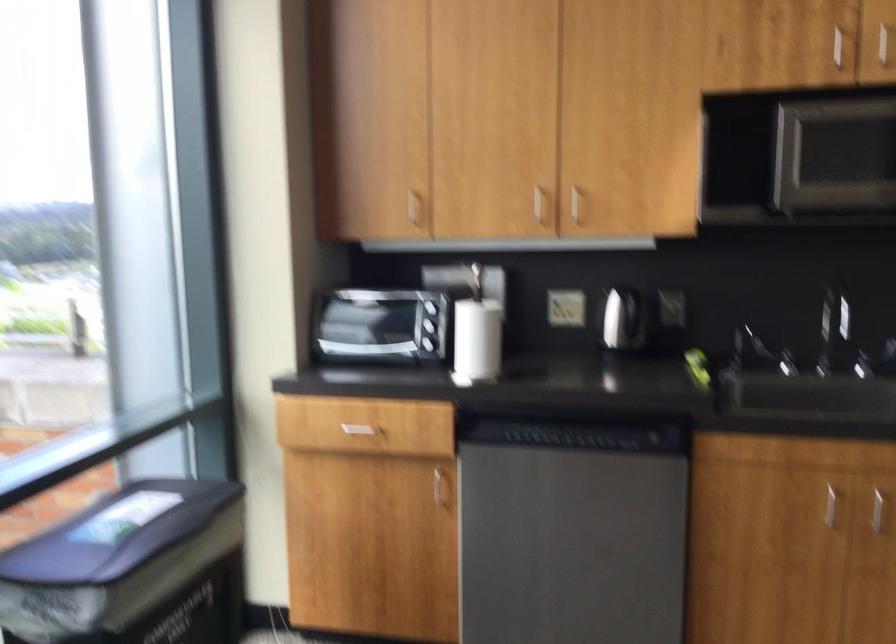
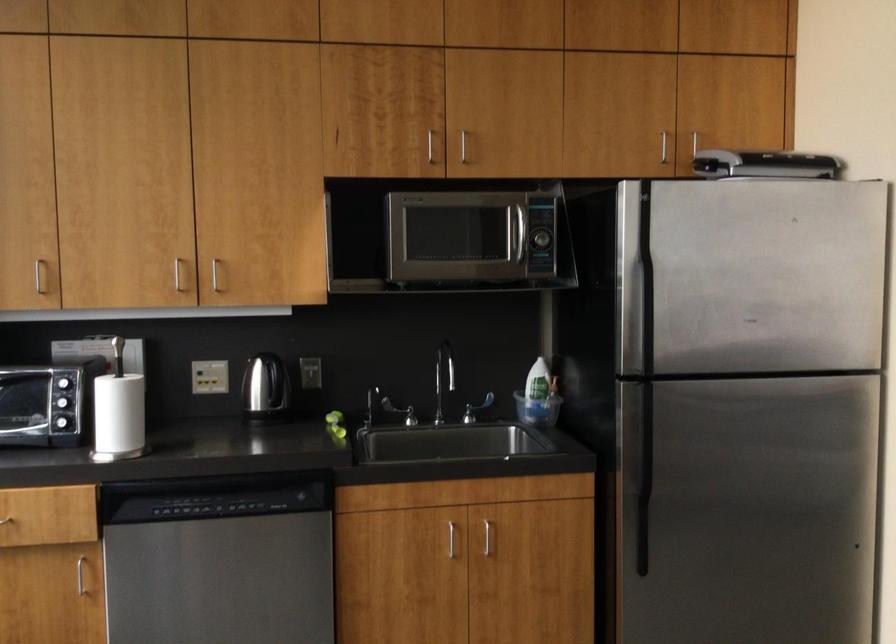
Where in the second image is the point corresponding to [553,404] from the first image?

(208, 471)